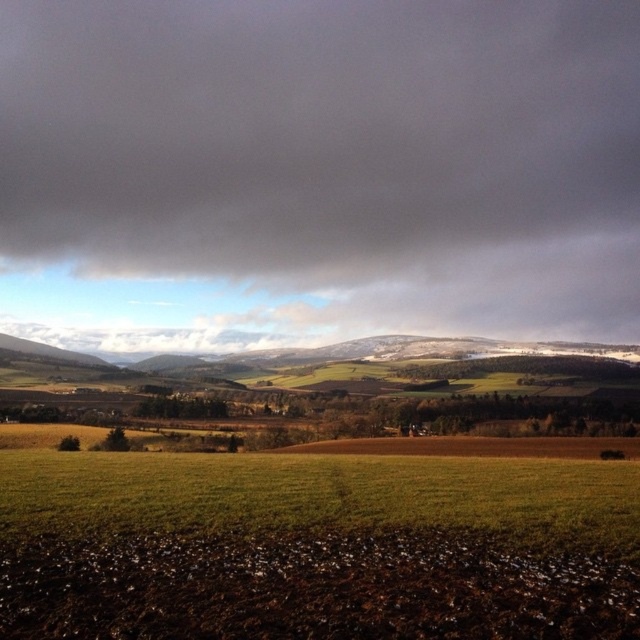
Question: Considering the relative positions of dark gray cloud at upper center and green grass at lower center in the image provided, where is dark gray cloud at upper center located with respect to green grass at lower center?

Choices:
 (A) below
 (B) above

Answer: (B)

Question: Does dark gray cloud at upper center appear on the left side of green grass at lower center?

Choices:
 (A) yes
 (B) no

Answer: (A)

Question: Among these objects, which one is nearest to the camera?

Choices:
 (A) dark gray cloud at upper center
 (B) green grass at lower center

Answer: (B)

Question: From the image, what is the correct spatial relationship of dark gray cloud at upper center in relation to green grass at lower center?

Choices:
 (A) left
 (B) right

Answer: (A)